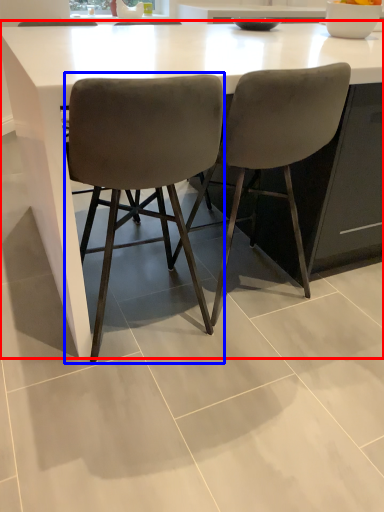
Question: Which point is further to the camera, table (highlighted by a red box) or chair (highlighted by a blue box)?

Choices:
 (A) table
 (B) chair

Answer: (A)